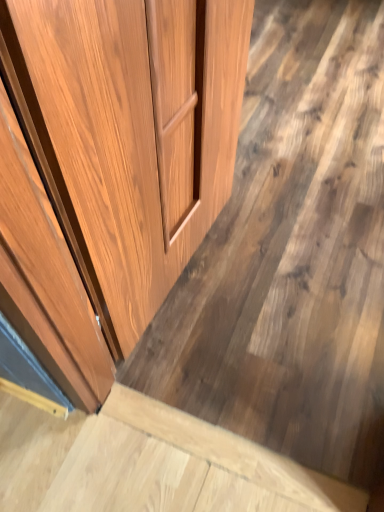
The width and height of the screenshot is (384, 512). What do you see at coordinates (291, 254) in the screenshot?
I see `natural wood cabinet at center` at bounding box center [291, 254].

Measure the distance between point (x=322, y=456) and camera.

1.23 meters.

You are a GUI agent. You are given a task and a screenshot of the screen. Output one action in this format:
    pyautogui.click(x=<x>, y=<y>)
    Task: Click on the natural wood cabinet at center
    The height and width of the screenshot is (512, 384).
    Given the screenshot: What is the action you would take?
    pyautogui.click(x=291, y=254)

You are a GUI agent. You are given a task and a screenshot of the screen. Output one action in this format:
    pyautogui.click(x=<x>, y=<y>)
    Task: Click on the natural wood cabinet at center
    The width and height of the screenshot is (384, 512).
    Given the screenshot: What is the action you would take?
    [x=291, y=254]